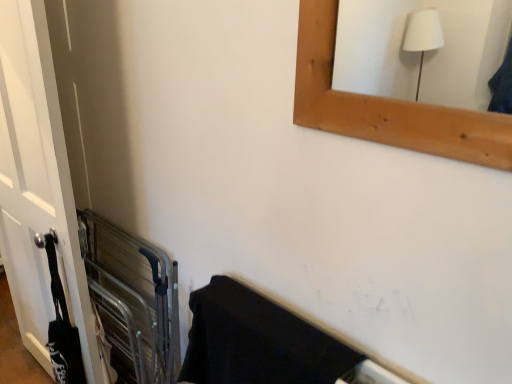
Question: Considering the positions of black matte towel at lower right and white matte door at left in the image, is black matte towel at lower right wider or thinner than white matte door at left?

Choices:
 (A) wide
 (B) thin

Answer: (A)

Question: In the image, is black matte towel at lower right on the left side or the right side of white matte door at left?

Choices:
 (A) left
 (B) right

Answer: (B)

Question: Estimate the real-world distances between objects in this image. Which object is farther from the metallic gray balustrade at left?

Choices:
 (A) black matte towel at lower right
 (B) white matte door at left

Answer: (A)

Question: Which is farther from the black matte towel at lower right?

Choices:
 (A) white matte door at left
 (B) metallic gray balustrade at left

Answer: (A)